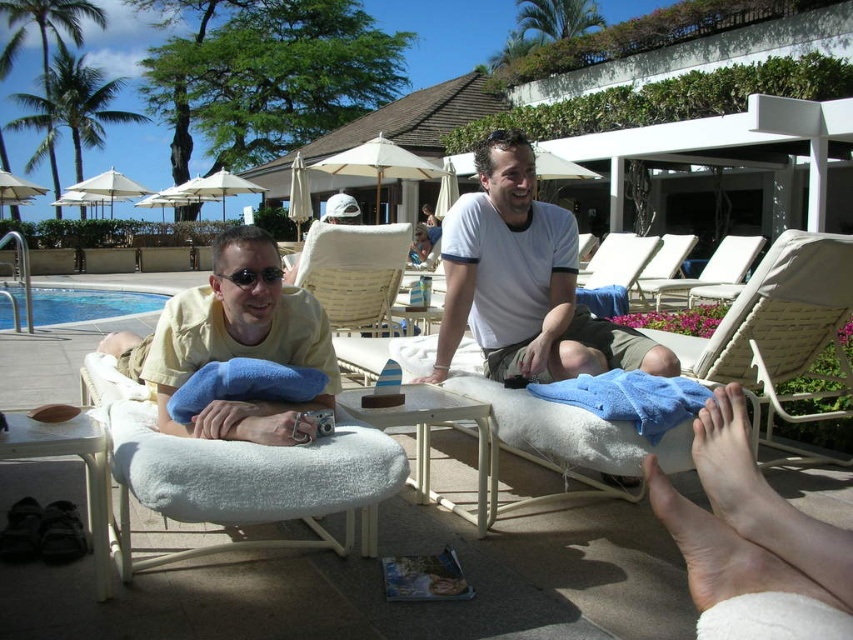
Is point (119, 332) positioned before point (345, 208)?

Yes, point (119, 332) is closer to viewer.

Based on the photo, does yellow cotton shirt at left appear on the right side of matte yellow shirt at center?

Indeed, yellow cotton shirt at left is positioned on the right side of matte yellow shirt at center.

Which is in front, point (331, 396) or point (345, 200)?

Positioned in front is point (331, 396).

At what (x,y) coordinates should I click in order to perform the action: click on yellow cotton shirt at left. Please return your answer as a coordinate pair (x, y). The height and width of the screenshot is (640, 853). Looking at the image, I should click on (233, 356).

Based on the photo, is blue glass water at lower left positioned behind white fabric lounge chair at center?

Yes.

Is blue glass water at lower left below white fabric lounge chair at center?

Yes, blue glass water at lower left is below white fabric lounge chair at center.

Who is more forward, (0,301) or (703,280)?

Point (703,280) is more forward.

The height and width of the screenshot is (640, 853). What are the coordinates of `blue glass water at lower left` in the screenshot? It's located at (90, 301).

Between point (335, 288) and point (39, 292), which one is positioned behind?

The point (39, 292) is more distant.

The width and height of the screenshot is (853, 640). What do you see at coordinates (355, 285) in the screenshot? I see `beige woven beach chair at center` at bounding box center [355, 285].

Between point (376, 300) and point (102, 310), which one is positioned behind?

The point (102, 310) is behind.

Find the location of a particular element. The height and width of the screenshot is (640, 853). beige woven beach chair at center is located at coordinates (355, 285).